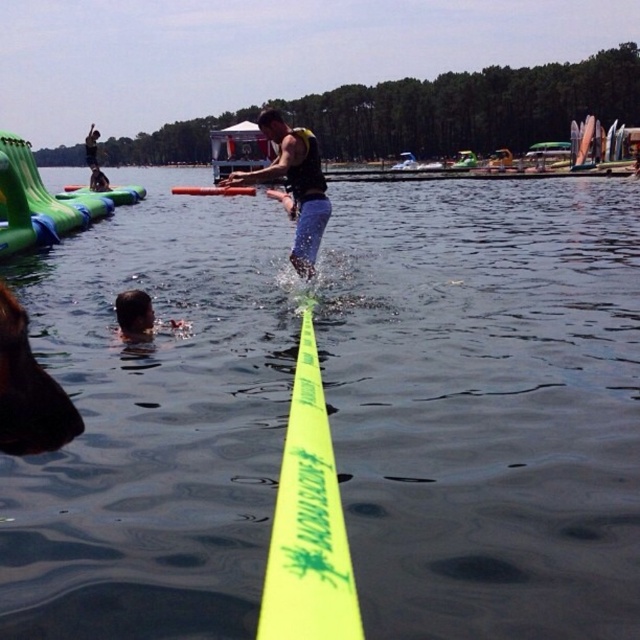
Question: Which point is farther to the camera?

Choices:
 (A) (17, 486)
 (B) (195, 186)
 (C) (93, 132)
 (D) (340, 579)

Answer: (B)

Question: Can you confirm if yellow neon tape at center is positioned below dark blue wetsuit at upper left?

Choices:
 (A) yes
 (B) no

Answer: (A)

Question: Can you confirm if yellow plastic paddle at center is positioned to the right of dark blue fabric shirt at upper left?

Choices:
 (A) yes
 (B) no

Answer: (A)

Question: Which point appears closest to the camera in this image?

Choices:
 (A) (90, 150)
 (B) (147, 301)

Answer: (B)

Question: Among these objects, which one is farthest from the camera?

Choices:
 (A) green inflatable boat at upper left
 (B) dark blue wetsuit at upper left

Answer: (B)

Question: Observing the image, what is the correct spatial positioning of yellow neon tape at center in reference to dark blue wetsuit at upper left?

Choices:
 (A) left
 (B) right

Answer: (B)